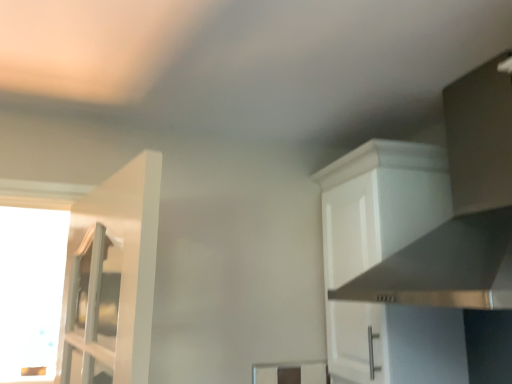
Question: Is white matte cabinet at upper right shorter than stainless steel vent at upper right?

Choices:
 (A) no
 (B) yes

Answer: (A)

Question: Can you confirm if white matte cabinet at upper right is thinner than stainless steel vent at upper right?

Choices:
 (A) yes
 (B) no

Answer: (A)

Question: Does white matte cabinet at upper right have a greater height compared to stainless steel vent at upper right?

Choices:
 (A) yes
 (B) no

Answer: (A)

Question: Can you confirm if white matte cabinet at upper right is positioned to the right of stainless steel vent at upper right?

Choices:
 (A) yes
 (B) no

Answer: (B)

Question: Considering the relative sizes of white matte cabinet at upper right and stainless steel vent at upper right in the image provided, is white matte cabinet at upper right smaller than stainless steel vent at upper right?

Choices:
 (A) yes
 (B) no

Answer: (A)

Question: Is white matte cabinet at upper right facing away from stainless steel vent at upper right?

Choices:
 (A) yes
 (B) no

Answer: (B)

Question: From the image's perspective, is transparent glass window at left beneath white matte cabinet at upper right?

Choices:
 (A) yes
 (B) no

Answer: (A)

Question: Does transparent glass window at left come in front of white matte cabinet at upper right?

Choices:
 (A) yes
 (B) no

Answer: (B)

Question: Considering the relative sizes of transparent glass window at left and white matte cabinet at upper right in the image provided, is transparent glass window at left thinner than white matte cabinet at upper right?

Choices:
 (A) no
 (B) yes

Answer: (B)

Question: Could you tell me if transparent glass window at left is turned towards white matte cabinet at upper right?

Choices:
 (A) yes
 (B) no

Answer: (B)

Question: Is transparent glass window at left not close to white matte cabinet at upper right?

Choices:
 (A) yes
 (B) no

Answer: (A)

Question: Is transparent glass window at left touching white matte cabinet at upper right?

Choices:
 (A) yes
 (B) no

Answer: (B)

Question: Does stainless steel vent at upper right have a greater height compared to transparent glass window at left?

Choices:
 (A) no
 (B) yes

Answer: (A)